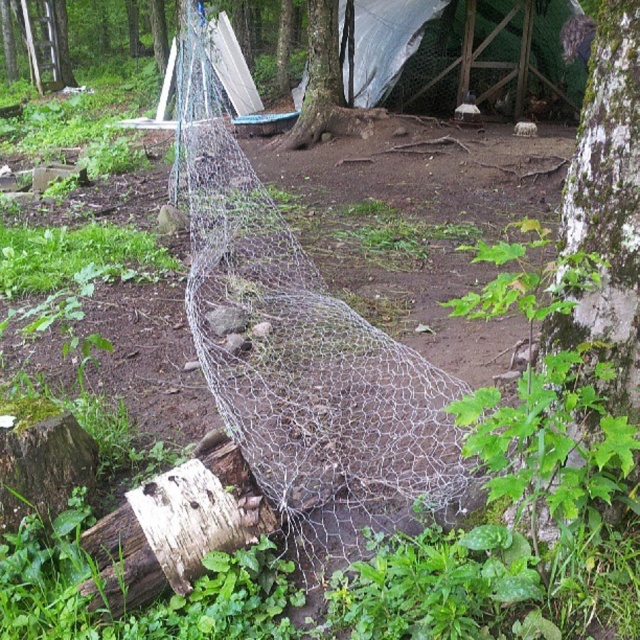
Question: Which is farther from the white textured bark at center right?

Choices:
 (A) wire mesh net at center
 (B) smooth bark tree at center

Answer: (B)

Question: Among these points, which one is farthest from the camera?

Choices:
 (A) 316,131
 (B) 388,429

Answer: (A)

Question: Is white textured bark at center right to the left of smooth bark tree at center from the viewer's perspective?

Choices:
 (A) no
 (B) yes

Answer: (A)

Question: Does white textured bark at center right appear under smooth bark tree at center?

Choices:
 (A) no
 (B) yes

Answer: (B)

Question: Does white textured bark at center right lie behind smooth bark tree at center?

Choices:
 (A) no
 (B) yes

Answer: (A)

Question: Considering the real-world distances, which object is closest to the white textured bark at center right?

Choices:
 (A) wire mesh net at center
 (B) smooth bark tree at center

Answer: (A)